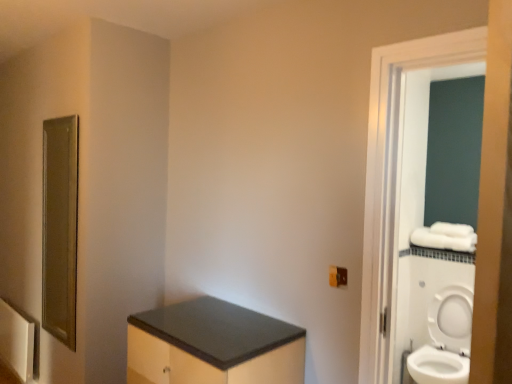
Question: Considering the positions of point (436, 382) and point (367, 158), is point (436, 382) closer or farther from the camera than point (367, 158)?

Choices:
 (A) farther
 (B) closer

Answer: (A)

Question: In the image, is white glossy toilet at right on the left side or the right side of white glossy screen door at right?

Choices:
 (A) right
 (B) left

Answer: (A)

Question: Estimate the real-world distances between objects in this image. Which object is closer to the matte brown electric outlet at lower right?

Choices:
 (A) white glossy toilet at right
 (B) matte black cabinet at lower center
 (C) gold textured mirror at left
 (D) white glossy screen door at right
 (E) white fabric towel bar at right

Answer: (D)

Question: Which is farther from the white fabric towel bar at right?

Choices:
 (A) white glossy screen door at right
 (B) matte black cabinet at lower center
 (C) gold textured mirror at left
 (D) matte brown electric outlet at lower right
 (E) white glossy toilet at right

Answer: (C)